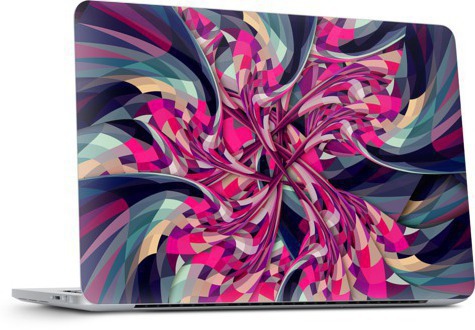
The image size is (475, 330). Find the location of `laptop right side`. laptop right side is located at coordinates (30, 294).